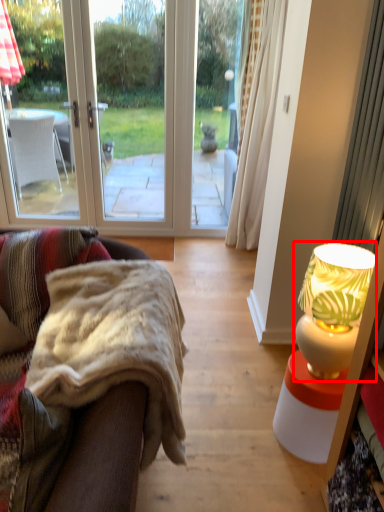
Question: From the image's perspective, what is the correct spatial relationship of lamp (annotated by the red box) in relation to studio couch?

Choices:
 (A) below
 (B) above

Answer: (B)